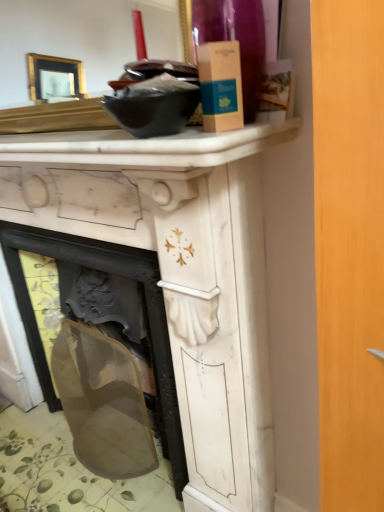
Question: Considering the relative sizes of transparent plastic screen at lower left and white marble counter top at upper center in the image provided, is transparent plastic screen at lower left smaller than white marble counter top at upper center?

Choices:
 (A) no
 (B) yes

Answer: (A)

Question: Is transparent plastic screen at lower left bigger than white marble counter top at upper center?

Choices:
 (A) no
 (B) yes

Answer: (B)

Question: Is the position of transparent plastic screen at lower left more distant than that of white marble counter top at upper center?

Choices:
 (A) yes
 (B) no

Answer: (A)

Question: From the image's perspective, is transparent plastic screen at lower left beneath white marble counter top at upper center?

Choices:
 (A) yes
 (B) no

Answer: (A)

Question: Is white marble counter top at upper center a part of transparent plastic screen at lower left?

Choices:
 (A) no
 (B) yes

Answer: (A)

Question: In terms of width, does white marble fireplace at center look wider or thinner when compared to white marble counter top at upper center?

Choices:
 (A) wide
 (B) thin

Answer: (A)

Question: Considering the positions of white marble fireplace at center and white marble counter top at upper center in the image, is white marble fireplace at center bigger or smaller than white marble counter top at upper center?

Choices:
 (A) big
 (B) small

Answer: (A)

Question: Is point (218, 463) closer or farther from the camera than point (173, 148)?

Choices:
 (A) closer
 (B) farther

Answer: (B)

Question: Considering the positions of white marble fireplace at center and white marble counter top at upper center in the image, is white marble fireplace at center taller or shorter than white marble counter top at upper center?

Choices:
 (A) tall
 (B) short

Answer: (A)

Question: In terms of size, does transparent plastic screen at lower left appear bigger or smaller than white marble fireplace at center?

Choices:
 (A) small
 (B) big

Answer: (A)

Question: Is transparent plastic screen at lower left to the left or to the right of white marble fireplace at center in the image?

Choices:
 (A) left
 (B) right

Answer: (A)

Question: Considering the positions of point (51, 463) and point (230, 175), is point (51, 463) closer or farther from the camera than point (230, 175)?

Choices:
 (A) closer
 (B) farther

Answer: (B)

Question: Considering the positions of transparent plastic screen at lower left and white marble fireplace at center in the image, is transparent plastic screen at lower left wider or thinner than white marble fireplace at center?

Choices:
 (A) thin
 (B) wide

Answer: (B)

Question: Considering the positions of white marble counter top at upper center and transparent plastic screen at lower left in the image, is white marble counter top at upper center wider or thinner than transparent plastic screen at lower left?

Choices:
 (A) thin
 (B) wide

Answer: (A)

Question: Is white marble counter top at upper center taller or shorter than transparent plastic screen at lower left?

Choices:
 (A) short
 (B) tall

Answer: (A)